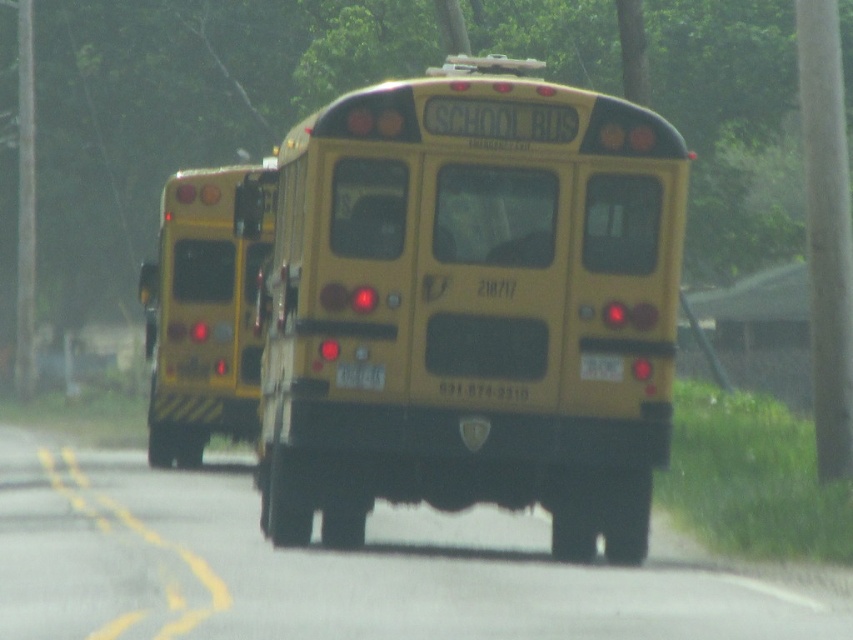
Question: From the image, what is the correct spatial relationship of yellow matte school bus at center in relation to yellow matte license plate at center?

Choices:
 (A) right
 (B) left

Answer: (A)

Question: Can you confirm if yellow matte school bus at center is positioned to the right of yellow matte license plate at center?

Choices:
 (A) no
 (B) yes

Answer: (B)

Question: Estimate the real-world distances between objects in this image. Which object is farther from the yellow matte license plate at center?

Choices:
 (A) yellow matte school bus at left
 (B) yellow matte school bus at center

Answer: (A)

Question: Among these points, which one is farthest from the camera?

Choices:
 (A) (374, 385)
 (B) (173, 294)
 (C) (338, 278)

Answer: (B)

Question: Which is nearer to the yellow matte school bus at center?

Choices:
 (A) yellow matte license plate at center
 (B) yellow matte school bus at left

Answer: (A)

Question: Is yellow matte school bus at left thinner than yellow matte license plate at center?

Choices:
 (A) yes
 (B) no

Answer: (B)